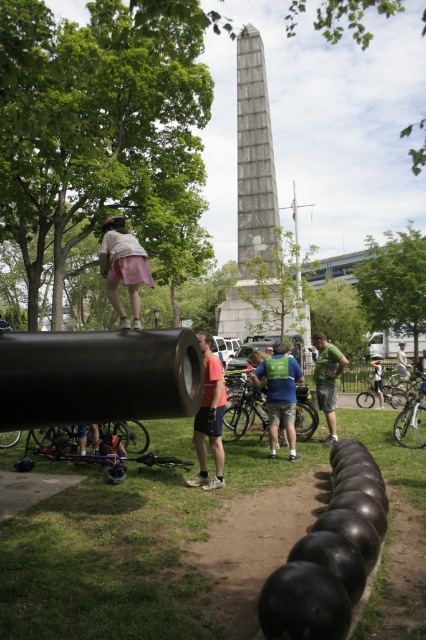
Is gray stone obelisk at center bigger than matte pink shorts at center?

Correct, gray stone obelisk at center is larger in size than matte pink shorts at center.

Is gray stone obelisk at center to the right of matte pink shorts at center from the viewer's perspective?

Correct, you'll find gray stone obelisk at center to the right of matte pink shorts at center.

At what (x,y) coordinates should I click in order to perform the action: click on gray stone obelisk at center. Please return your answer as a coordinate pair (x, y). The image size is (426, 640). Looking at the image, I should click on point(252,189).

Does pink fabric skirt at upper center have a lesser width compared to matte pink shorts at center?

Incorrect, pink fabric skirt at upper center's width is not less than matte pink shorts at center's.

Between point (132, 234) and point (213, 433), which one is positioned behind?

The point (132, 234) is behind.

The height and width of the screenshot is (640, 426). Identify the location of pink fabric skirt at upper center. (123, 266).

In order to click on pink fabric skirt at upper center in this screenshot , I will do `click(123, 266)`.

Does black matte cannon at center come in front of light blue denim shorts at center?

Yes.

Does point (161, 348) come farther from viewer compared to point (400, 378)?

That is False.

Where is `black matte cannon at center`? Image resolution: width=426 pixels, height=640 pixels. black matte cannon at center is located at coordinates (97, 376).

Where is `black matte cannon at center`? black matte cannon at center is located at coordinates (97, 376).